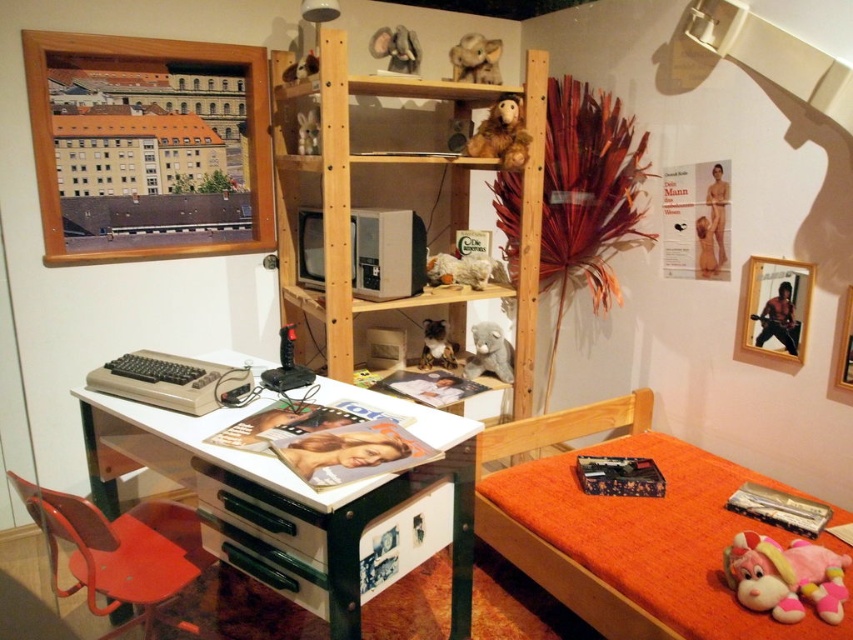
You are standing in the room and want to place a new lamp on the desk. The lamp requires a surface that is at least 3 feet away from the camera to avoid blocking the view. Is the desk surface at point (511, 118) suitable?

The distance of point (511, 118) from camera is 7.74 feet, which is more than 3 feet, so the desk surface at point (511, 118) is suitable for placing the lamp without blocking the view.

You are standing in the room and want to place a new lamp between the two points, point (520, 168) and point (390, 35). Which point should the lamp be closer to if you want it to be closer to the front of the room?

The lamp should be placed closer to point (520, 168) because it is in front of point (390, 35).

In the scene shown: You are organizing a small party in this room and need to place a cake on the table. The cake is 30 cm wide. There is a matte plastic chair at lower left and a fuzzy gray teddy bear at center. Which object is closer to the right side of the table where the cake will be placed?

The fuzzy gray teddy bear at center is closer to the right side of the table because it is positioned to the right of the matte plastic chair at lower left.